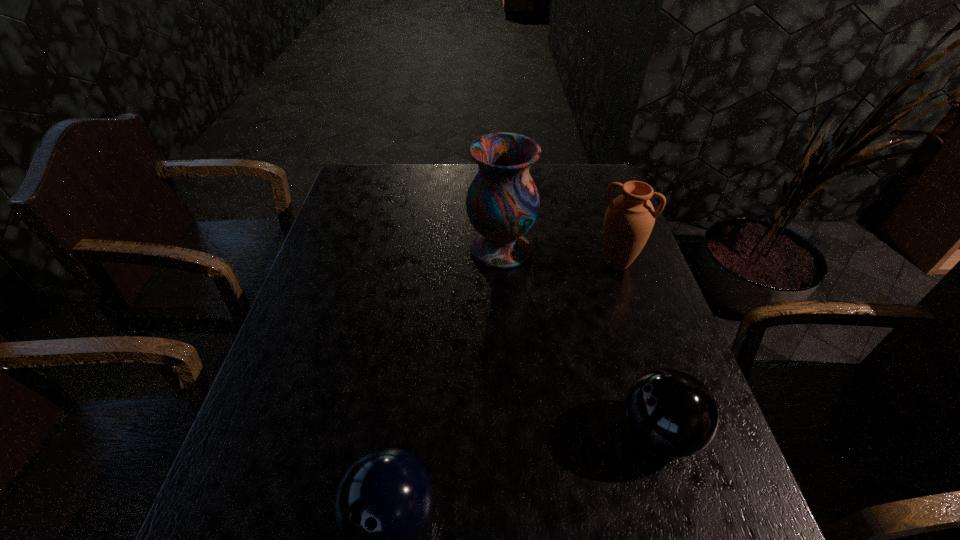
The image size is (960, 540). I want to click on the tallest object, so click(x=502, y=202).

Image resolution: width=960 pixels, height=540 pixels. What are the coordinates of `the second object from left to right` in the screenshot? It's located at (502, 202).

I want to click on urn, so click(629, 219).

Identify the location of the right bowling ball. (671, 412).

Where is `free region located 0.080m on the left of the vase`? The width and height of the screenshot is (960, 540). free region located 0.080m on the left of the vase is located at coordinates tap(439, 249).

This screenshot has height=540, width=960. Find the location of `vacant space located 0.220m on the front of the second tallest object`. vacant space located 0.220m on the front of the second tallest object is located at coordinates (644, 345).

This screenshot has height=540, width=960. What are the coordinates of `vacant space located 0.230m on the surface of the right bowling ball near the finger holes` in the screenshot? It's located at (502, 433).

Where is `free space located 0.170m on the surface of the right bowling ball near the finger holes`? Image resolution: width=960 pixels, height=540 pixels. free space located 0.170m on the surface of the right bowling ball near the finger holes is located at coordinates (532, 433).

Identify the location of free spot located 0.190m on the surface of the right bowling ball near the finger holes. The width and height of the screenshot is (960, 540). (522, 433).

This screenshot has width=960, height=540. In order to click on urn located in the right edge section of the desktop in this screenshot , I will do [629, 219].